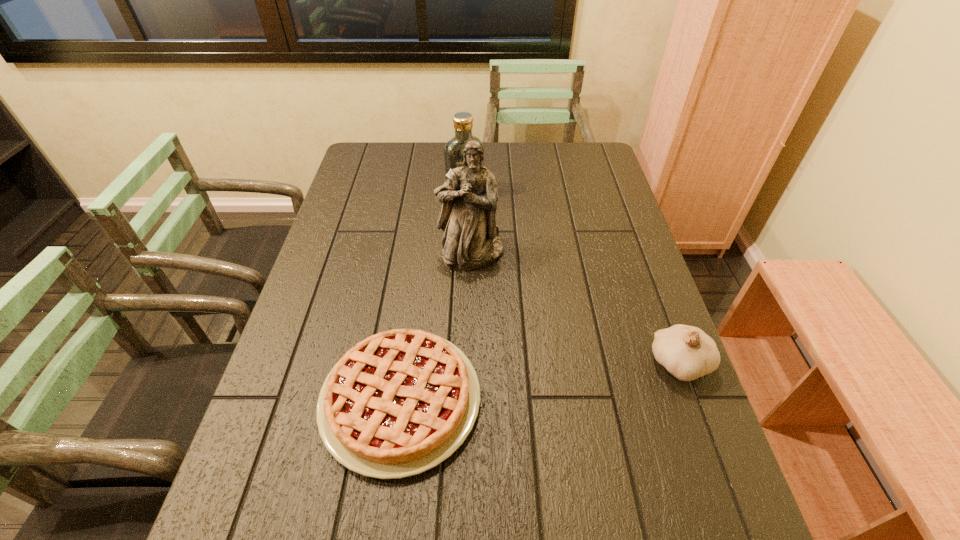
I want to click on free space between the third nearest object and the shortest object, so click(436, 327).

I want to click on vacant region between the third shortest object and the garlic, so [572, 279].

In order to click on blank region between the garlic and the shortest object in this screenshot , I will do `click(540, 382)`.

Identify the location of vacant area between the figurine and the garlic. Image resolution: width=960 pixels, height=540 pixels. (575, 309).

In order to click on vacant space that's between the garlic and the farthest object in this screenshot , I will do `click(572, 279)`.

The width and height of the screenshot is (960, 540). I want to click on object that stands as the closest to the third nearest object, so click(x=453, y=151).

Identify which object is the closest to the second shortest object. Please provide its 2D coordinates. Your answer should be formatted as a tuple, i.e. [(x, y)], where the tuple contains the x and y coordinates of a point satisfying the conditions above.

[(400, 402)]

Identify the location of free space that satisfies the following two spatial constraints: 1. on the back side of the farthest object; 2. on the left side of the pie. (429, 194).

You are a GUI agent. You are given a task and a screenshot of the screen. Output one action in this format:
    pyautogui.click(x=<x>, y=<y>)
    Task: Click on the vacant space that satisfies the following two spatial constraints: 1. on the back side of the second farthest object; 2. on the right side of the shortest object
    
    Given the screenshot: What is the action you would take?
    pyautogui.click(x=420, y=253)

Image resolution: width=960 pixels, height=540 pixels. Identify the location of vacant space that satisfies the following two spatial constraints: 1. on the back side of the vodka; 2. on the right side of the shortest object. (429, 194).